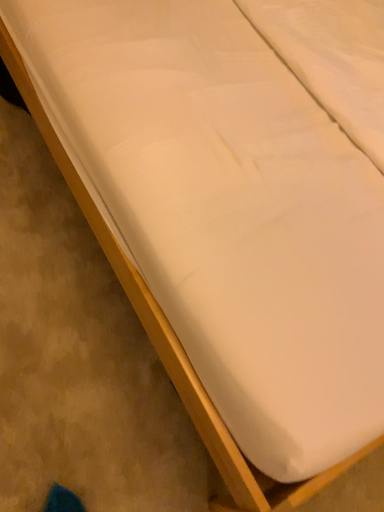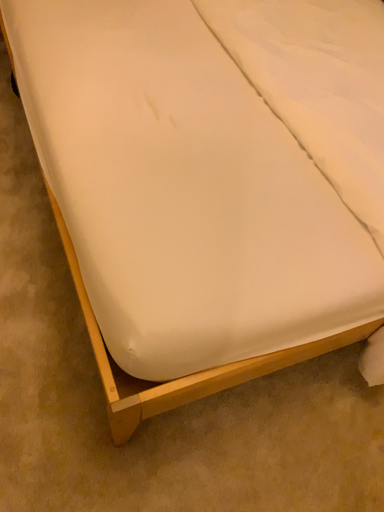
Question: Which way did the camera rotate in the video?

Choices:
 (A) rotated upward
 (B) rotated downward

Answer: (A)